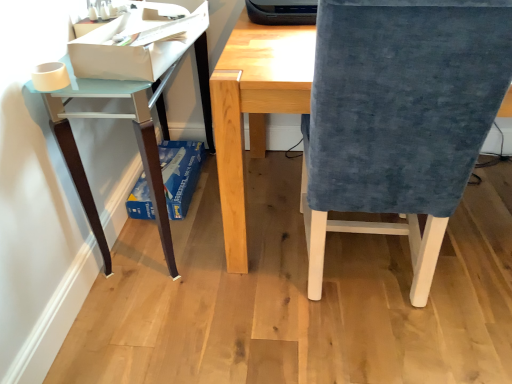
Question: Does point (419, 96) appear closer or farther from the camera than point (197, 158)?

Choices:
 (A) farther
 (B) closer

Answer: (B)

Question: Considering the positions of velvet blue chair at right and blue cardboard box at lower left, the 1th paperback book from the bottom, in the image, is velvet blue chair at right bigger or smaller than blue cardboard box at lower left, the 1th paperback book from the bottom,?

Choices:
 (A) big
 (B) small

Answer: (A)

Question: Which object is the farthest from the light blue glossy table at left?

Choices:
 (A) white paper at upper left, arranged as the 1th paperback book when viewed from the front
 (B) blue cardboard box at lower left, the second paperback book from the front
 (C) velvet blue chair at right

Answer: (C)

Question: Which of these objects is positioned closest to the velvet blue chair at right?

Choices:
 (A) light blue glossy table at left
 (B) white paper at upper left, arranged as the 1th paperback book when viewed from the front
 (C) blue cardboard box at lower left, the second paperback book from the front

Answer: (A)